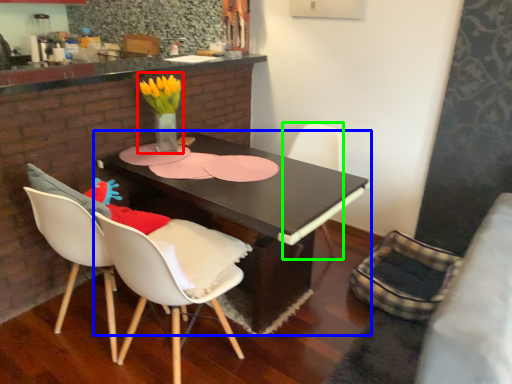
Question: Considering the real-world distances, which object is closest to floral arrangement (highlighted by a red box)? table (highlighted by a blue box) or chair (highlighted by a green box).

Choices:
 (A) table
 (B) chair

Answer: (A)